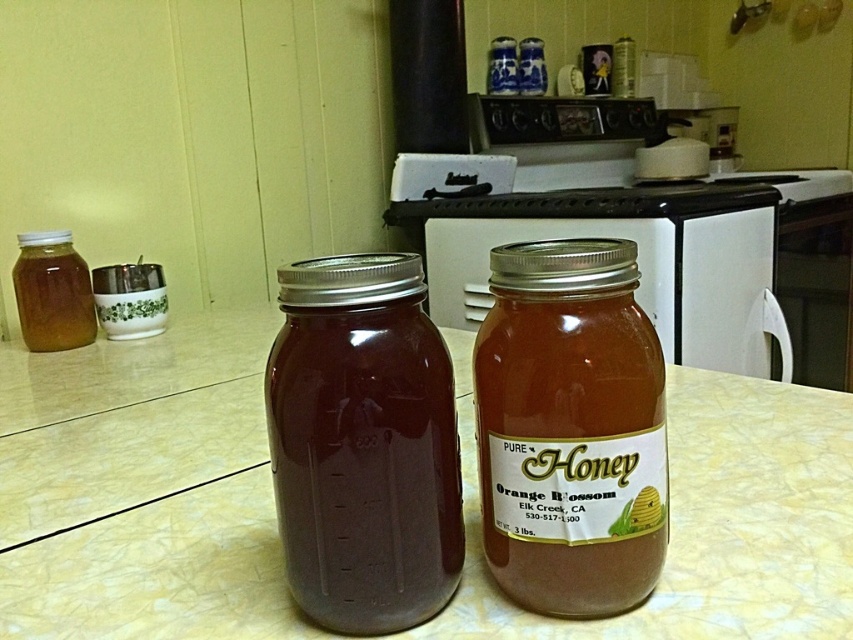
Question: Estimate the real-world distances between objects in this image. Which object is farther from the golden honey jar at center?

Choices:
 (A) brown glass jar at center
 (B) translucent glass jar at center

Answer: (B)

Question: Which of these objects is positioned farthest from the translucent glass jar at center?

Choices:
 (A) brown glass jar at center
 (B) translucent amber honey jar at left
 (C) golden honey jar at center

Answer: (B)

Question: Is translucent glass jar at center positioned in front of translucent amber honey jar at left?

Choices:
 (A) yes
 (B) no

Answer: (A)

Question: Does translucent glass jar at center have a lesser width compared to translucent amber honey jar at left?

Choices:
 (A) no
 (B) yes

Answer: (A)

Question: Among these objects, which one is farthest from the camera?

Choices:
 (A) translucent glass jar at center
 (B) golden honey jar at center
 (C) translucent amber honey jar at left

Answer: (C)

Question: Can you confirm if translucent glass jar at center is thinner than brown glass jar at center?

Choices:
 (A) no
 (B) yes

Answer: (A)